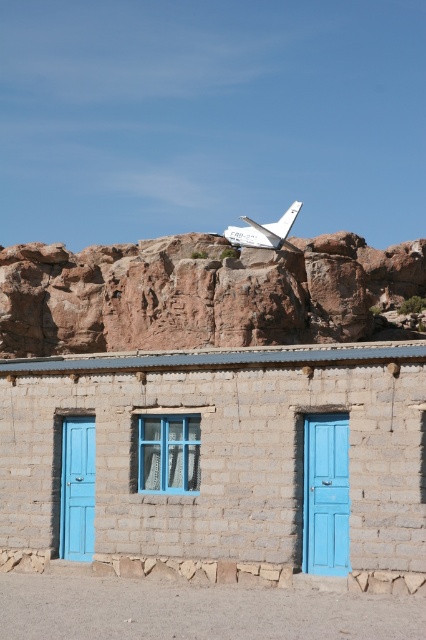
Question: Is brown rocky cliff at upper center further to camera compared to white matte airplane at upper center?

Choices:
 (A) no
 (B) yes

Answer: (A)

Question: Which point is farther to the camera?

Choices:
 (A) (273, 248)
 (B) (340, 417)
 (C) (83, 467)

Answer: (A)

Question: Which of the following is the farthest from the observer?

Choices:
 (A) (69, 513)
 (B) (40, 371)

Answer: (A)

Question: Which object is positioned closest to the brown stone cliff at upper center?

Choices:
 (A) blue matte door at left
 (B) brown rocky cliff at upper center
 (C) white matte airplane at upper center
 (D) blue matte door at center

Answer: (D)

Question: Is the position of brown stone cliff at upper center more distant than that of blue matte door at center?

Choices:
 (A) no
 (B) yes

Answer: (A)

Question: Is the position of brown rocky cliff at upper center more distant than that of blue matte door at left?

Choices:
 (A) yes
 (B) no

Answer: (A)